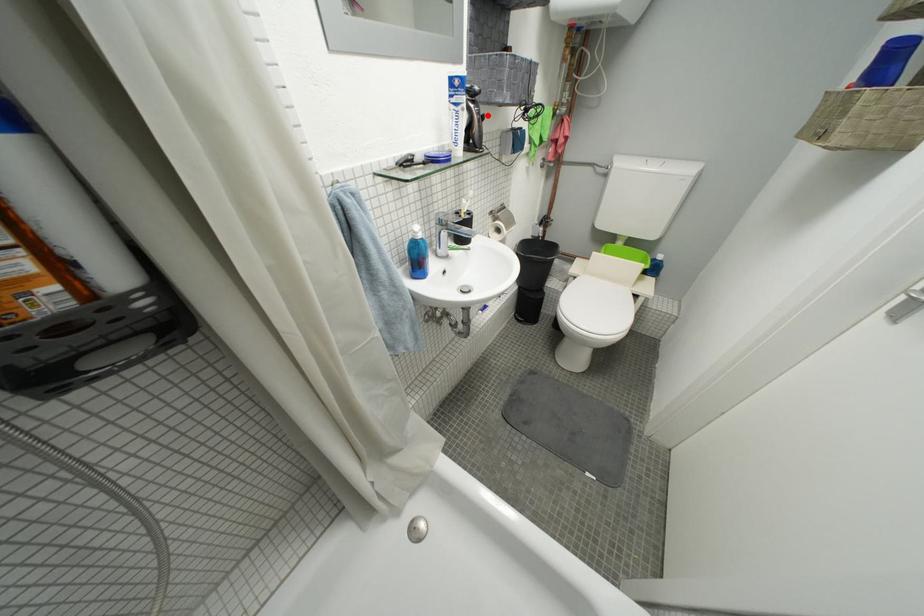
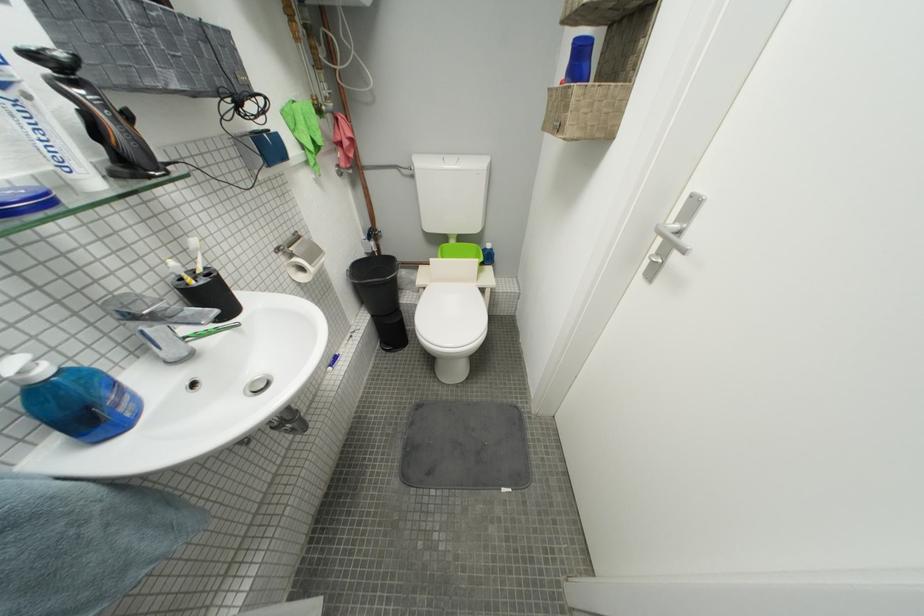
Question: I am providing you with two images of the same scene from different viewpoints. Image1 has a red point marked. In image2, the corresponding 3D location appears at what relative position? Reply with the corresponding letter.

Choices:
 (A) Closer
 (B) Farther

Answer: (B)